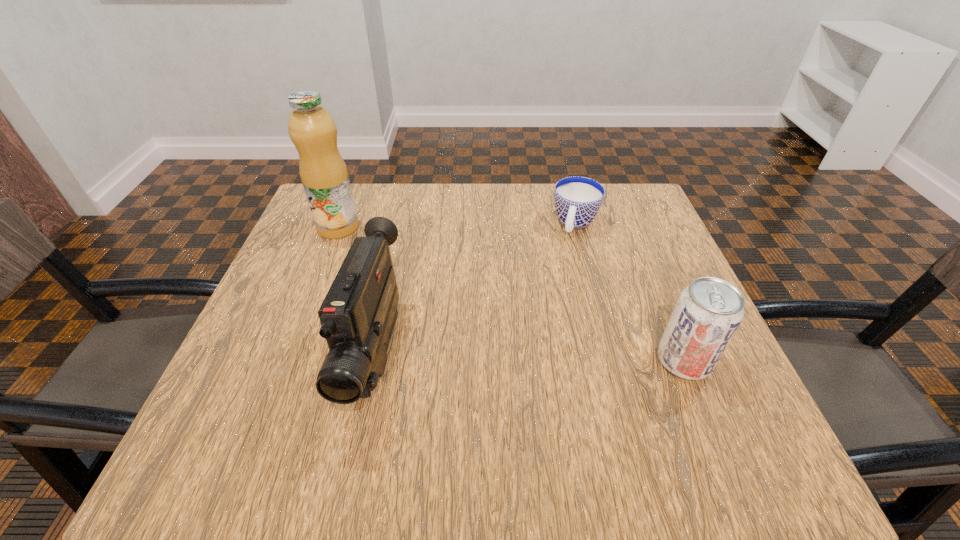
You are a GUI agent. You are given a task and a screenshot of the screen. Output one action in this format:
    pyautogui.click(x=<x>, y=<y>)
    Task: Click on the blank space at the near right corner
    
    Given the screenshot: What is the action you would take?
    pyautogui.click(x=720, y=390)

Where is `vacant region between the soda can and the camcorder`? The width and height of the screenshot is (960, 540). vacant region between the soda can and the camcorder is located at coordinates (530, 357).

Identify the location of vacant point located between the tallest object and the third object from left to right. (457, 226).

Where is `free spot between the tallest object and the rightmost object`? The height and width of the screenshot is (540, 960). free spot between the tallest object and the rightmost object is located at coordinates (511, 294).

Where is `free space between the tallest object and the soda can`? The width and height of the screenshot is (960, 540). free space between the tallest object and the soda can is located at coordinates [511, 294].

Where is `empty space between the camcorder and the cup`? empty space between the camcorder and the cup is located at coordinates (476, 289).

Locate an element on the screen. unoccupied area between the shortest object and the second tallest object is located at coordinates (476, 289).

You are a GUI agent. You are given a task and a screenshot of the screen. Output one action in this format:
    pyautogui.click(x=<x>, y=<y>)
    Task: Click on the free space that is in between the rightmost object and the tallest object
    The width and height of the screenshot is (960, 540).
    Given the screenshot: What is the action you would take?
    pyautogui.click(x=511, y=294)

I want to click on vacant space in between the second object from right to left and the camcorder, so click(476, 289).

Where is `free space between the soda can and the second object from left to right`? free space between the soda can and the second object from left to right is located at coordinates (530, 357).